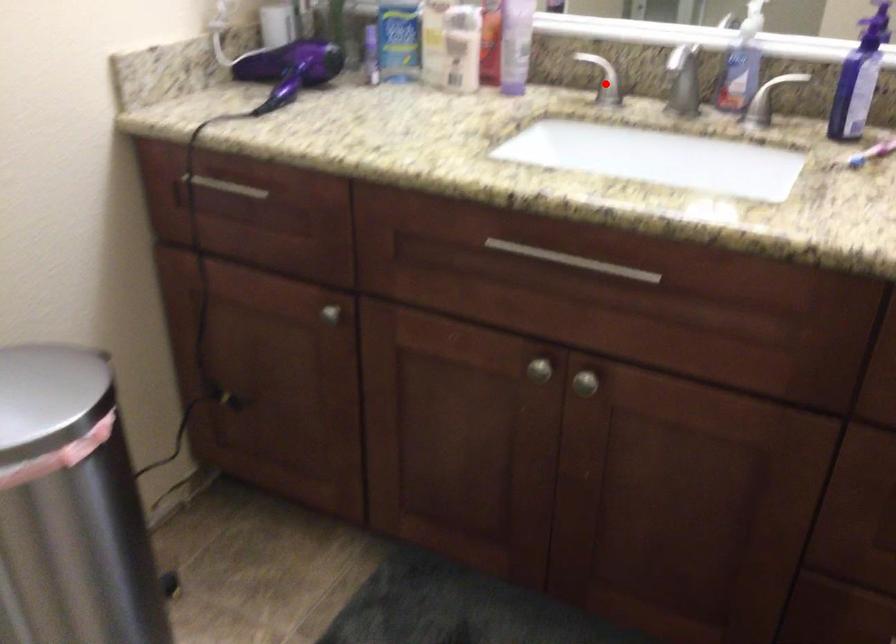
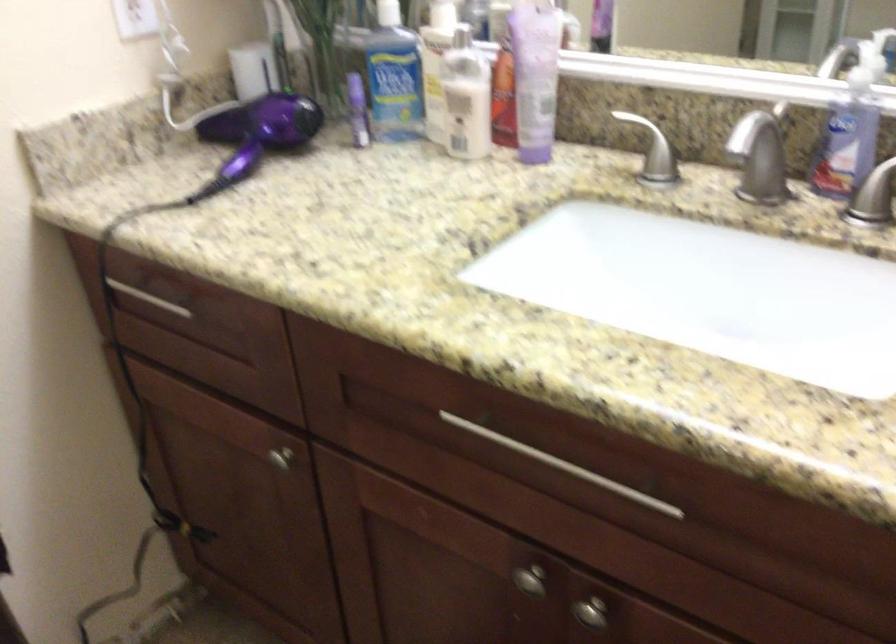
Question: I am providing you with two images of the same scene from different viewpoints. A red point is shown in image1. For the corresponding object point in image2, is it positioned nearer or farther from the camera?

Choices:
 (A) Nearer
 (B) Farther

Answer: (A)